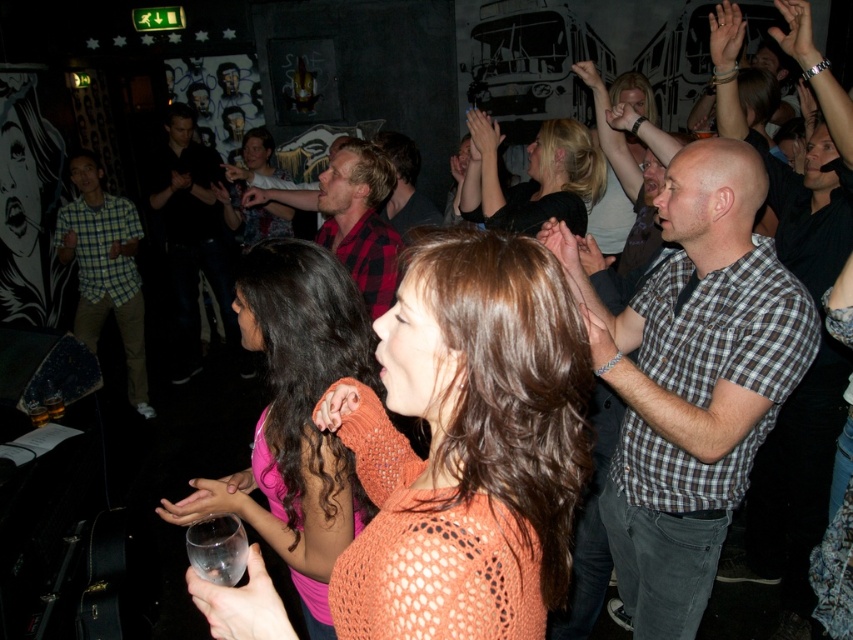
Which is in front, point (349, 460) or point (241, 188)?

Point (349, 460) is more forward.

Does knitted orange sweater at center lie in front of matte black shirt at center?

Yes, knitted orange sweater at center is closer to the viewer.

Find the location of a particular element. The width and height of the screenshot is (853, 640). knitted orange sweater at center is located at coordinates (296, 417).

The image size is (853, 640). I want to click on knitted orange sweater at center, so click(x=296, y=417).

Between point (299, 304) and point (556, 150), which one is positioned behind?

Positioned behind is point (556, 150).

Looking at this image, is knitted orange sweater at center smaller than blonde hair at center?

Indeed, knitted orange sweater at center has a smaller size compared to blonde hair at center.

Where is `knitted orange sweater at center`? This screenshot has width=853, height=640. knitted orange sweater at center is located at coordinates (296, 417).

Is red plaid shirt at center positioned before flannel shirt at center?

Yes.

Which of these two, red plaid shirt at center or flannel shirt at center, stands shorter?

With less height is flannel shirt at center.

Is point (337, 230) closer to viewer compared to point (433, 205)?

Yes, it is in front of point (433, 205).

Locate an element on the screen. This screenshot has height=640, width=853. red plaid shirt at center is located at coordinates (360, 220).